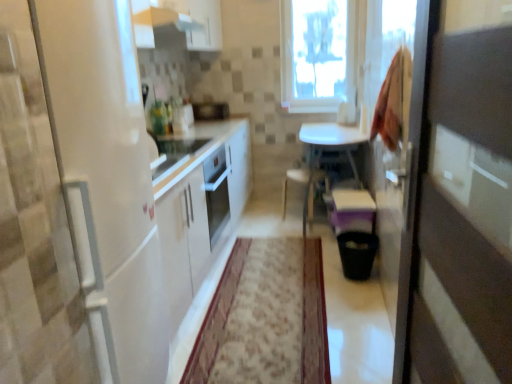
Describe the element at coordinates (332, 140) in the screenshot. I see `white glossy table at center` at that location.

What is the approximate width of white glossy refrigerator at left?

The width of white glossy refrigerator at left is 20.13 inches.

What is the approximate width of white glossy exhaust hood at upper center?

The width of white glossy exhaust hood at upper center is 16.96 inches.

Describe the element at coordinates (210, 110) in the screenshot. I see `satin black microwave at center` at that location.

In order to face carpet with floral pattern at center, should I rotate leftwards or rightwards?

To align with it, rotate right about 1.760°.

Where is `wooden chair at center`? This screenshot has width=512, height=384. wooden chair at center is located at coordinates (305, 190).

Based on the photo, from the image's perspective, which object appears higher, white glossy table at center or satin black microwave at center?

From the image's view, satin black microwave at center is above.

Is satin black microwave at center located within white glossy table at center?

No.

From a real-world perspective, is white glossy table at center located higher than satin black microwave at center?

No, from a real-world perspective, white glossy table at center is not above satin black microwave at center.

Which is in front, white glossy refrigerator at left or carpet with floral pattern at center?

white glossy refrigerator at left is closer to the camera.

Between point (64, 147) and point (215, 336), which one is positioned in front?

The point (64, 147) is closer to the camera.

Is white glossy refrigerator at left wider than carpet with floral pattern at center?

No.

From the image's perspective, between transparent glass window at upper center and wooden chair at center, which one is located above?

transparent glass window at upper center, from the image's perspective.

Is wooden chair at center a part of transparent glass window at upper center?

No, wooden chair at center is not inside transparent glass window at upper center.

Where is `chair to the left of transparent glass window at upper center`? chair to the left of transparent glass window at upper center is located at coordinates click(x=305, y=190).

In the scene shown: Is there a large distance between transparent glass window at upper center and wooden chair at center?

Yes, transparent glass window at upper center and wooden chair at center are located far from each other.

Which of these two, white glossy refrigerator at left or transparent glass window at upper center, is thinner?

transparent glass window at upper center is thinner.

In the scene shown: Is transparent glass window at upper center at the back of white glossy refrigerator at left?

No, white glossy refrigerator at left's orientation is not away from transparent glass window at upper center.

Is white glossy refrigerator at left inside or outside of transparent glass window at upper center?

white glossy refrigerator at left is outside transparent glass window at upper center.

This screenshot has height=384, width=512. Find the location of `exhaust hood below the transparent glass window at upper center (from the image's perspective)`. exhaust hood below the transparent glass window at upper center (from the image's perspective) is located at coordinates (157, 21).

From the image's perspective, which is above, white glossy exhaust hood at upper center or transparent glass window at upper center?

transparent glass window at upper center appears higher in the image.

Between white glossy exhaust hood at upper center and transparent glass window at upper center, which one has smaller width?

Thinner between the two is transparent glass window at upper center.

Is white glossy exhaust hood at upper center smaller than transparent glass window at upper center?

Correct, white glossy exhaust hood at upper center occupies less space than transparent glass window at upper center.

I want to click on chair on the right of carpet with floral pattern at center, so click(305, 190).

From the image's perspective, is carpet with floral pattern at center positioned above or below wooden chair at center?

From the image's perspective, carpet with floral pattern at center appears below wooden chair at center.

From a real-world perspective, is carpet with floral pattern at center physically below wooden chair at center?

Indeed, from a real-world perspective, carpet with floral pattern at center is positioned beneath wooden chair at center.

Considering the relative sizes of transparent glass window at upper center and carpet with floral pattern at center in the image provided, is transparent glass window at upper center wider than carpet with floral pattern at center?

No.

Is transparent glass window at upper center positioned with its back to carpet with floral pattern at center?

transparent glass window at upper center is not turned away from carpet with floral pattern at center.

Between transparent glass window at upper center and carpet with floral pattern at center, which one appears on the left side from the viewer's perspective?

Positioned to the left is carpet with floral pattern at center.

Which object is closer to the camera taking this photo, transparent glass window at upper center or carpet with floral pattern at center?

Positioned in front is carpet with floral pattern at center.

What are the coordinates of `table below the satin black microwave at center (from a real-world perspective)` in the screenshot? It's located at (332, 140).

Find the location of a particular element. This screenshot has height=384, width=512. plain behind the white glossy refrigerator at left is located at coordinates (314, 317).

Which object lies further to the anchor point transparent glass window at upper center, white glossy table at center or carpet with floral pattern at center?

carpet with floral pattern at center is further to transparent glass window at upper center.

Looking at the image, which one is located closer to wooden chair at center, white glossy refrigerator at left or carpet with floral pattern at center?

carpet with floral pattern at center is closer to wooden chair at center.

Estimate the real-world distances between objects in this image. Which object is closer to white glossy table at center, white glossy exhaust hood at upper center or wooden chair at center?

The object closer to white glossy table at center is wooden chair at center.

Based on their spatial positions, is transparent glass window at upper center or white glossy refrigerator at left further from satin black microwave at center?

white glossy refrigerator at left lies further to satin black microwave at center than the other object.

Looking at this image, which object lies further to the anchor point transparent glass window at upper center, white glossy exhaust hood at upper center or carpet with floral pattern at center?

The object further to transparent glass window at upper center is carpet with floral pattern at center.

Which object lies nearer to the anchor point white glossy exhaust hood at upper center, white glossy table at center or satin black microwave at center?

white glossy table at center lies closer to white glossy exhaust hood at upper center than the other object.

Looking at the image, which one is located closer to wooden chair at center, white glossy table at center or carpet with floral pattern at center?

The object closer to wooden chair at center is white glossy table at center.

Based on their spatial positions, is satin black microwave at center or wooden chair at center further from carpet with floral pattern at center?

The object further to carpet with floral pattern at center is satin black microwave at center.

Locate an element on the screen. This screenshot has width=512, height=384. appliance that lies between transparent glass window at upper center and wooden chair at center from top to bottom is located at coordinates (210, 110).

Identify the location of chair between carpet with floral pattern at center and transparent glass window at upper center along the z-axis. (305, 190).

Find the location of a particular element. Image resolution: width=512 pixels, height=384 pixels. plain located between white glossy refrigerator at left and satin black microwave at center in the depth direction is located at coordinates (314, 317).

Locate an element on the screen. window between carpet with floral pattern at center and satin black microwave at center along the z-axis is located at coordinates (318, 55).